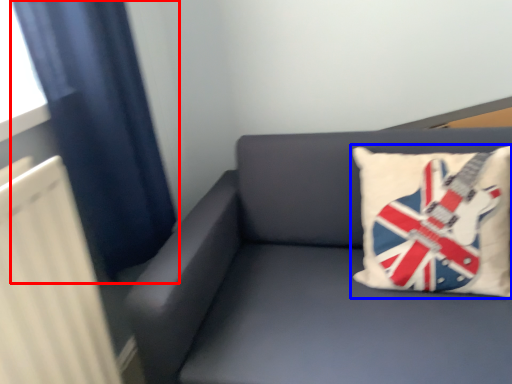
Question: Among these objects, which one is farthest to the camera, curtain (highlighted by a red box) or pillow (highlighted by a blue box)?

Choices:
 (A) curtain
 (B) pillow

Answer: (B)